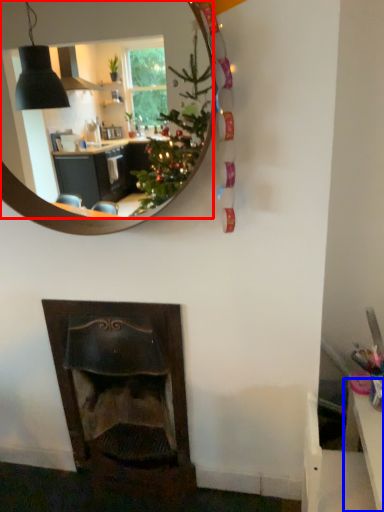
Question: Which object is further to the camera taking this photo, mirror (highlighted by a red box) or table (highlighted by a blue box)?

Choices:
 (A) mirror
 (B) table

Answer: (B)